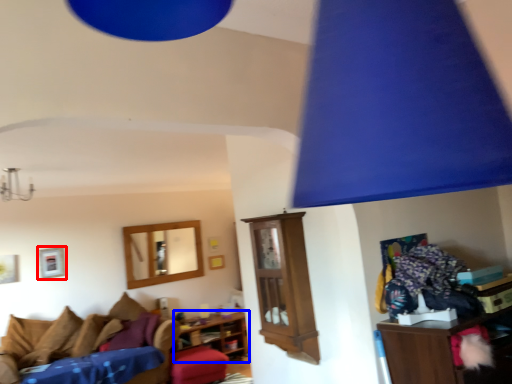
Question: Among these objects, which one is farthest to the camera, picture frame (highlighted by a red box) or shelf (highlighted by a blue box)?

Choices:
 (A) picture frame
 (B) shelf

Answer: (B)